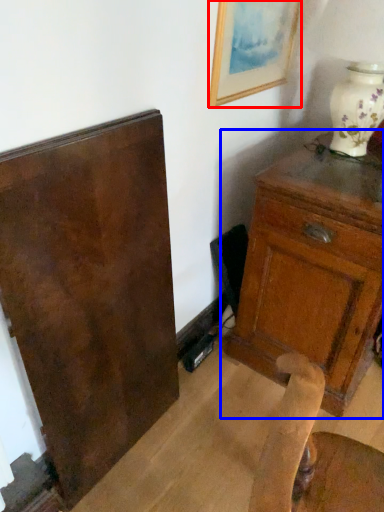
Question: Among these objects, which one is farthest to the camera, picture frame (highlighted by a red box) or chest of drawers (highlighted by a blue box)?

Choices:
 (A) picture frame
 (B) chest of drawers

Answer: (A)